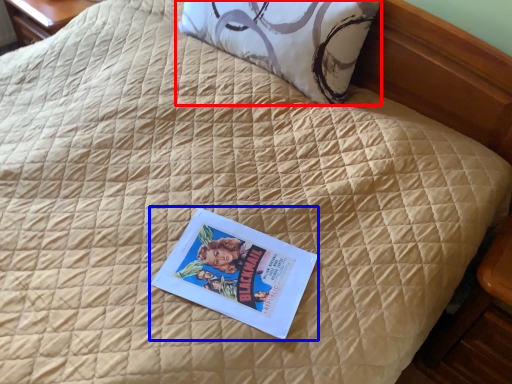
Question: Which object is closer to the camera taking this photo, pillow (highlighted by a red box) or paperback book (highlighted by a blue box)?

Choices:
 (A) pillow
 (B) paperback book

Answer: (B)